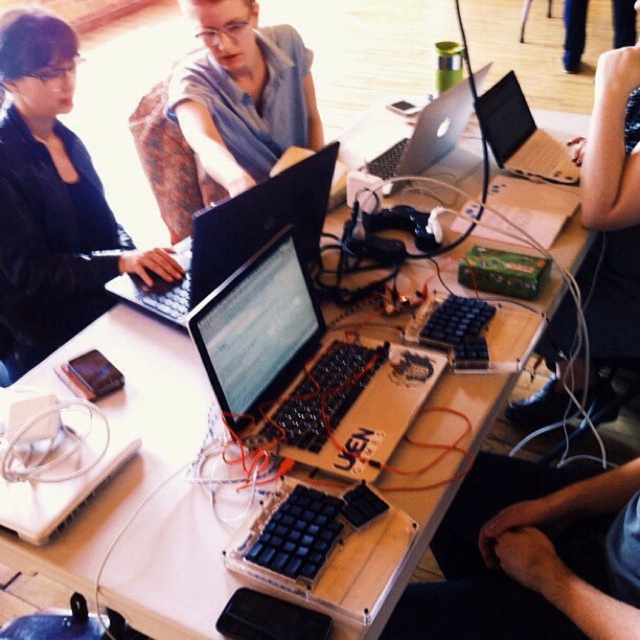
Does translucent plastic laptop at center have a larger size compared to black fabric sleeve at upper right?

No, translucent plastic laptop at center is not bigger than black fabric sleeve at upper right.

Image resolution: width=640 pixels, height=640 pixels. What are the coordinates of `translucent plastic laptop at center` in the screenshot? It's located at [x=305, y=371].

Does point (404, 346) come behind point (630, 324)?

No.

You are a GUI agent. You are given a task and a screenshot of the screen. Output one action in this format:
    pyautogui.click(x=<x>, y=<y>)
    Task: Click on the translucent plastic laptop at center
    
    Given the screenshot: What is the action you would take?
    pyautogui.click(x=305, y=371)

This screenshot has width=640, height=640. Describe the element at coordinates (531, 557) in the screenshot. I see `black matte keyboard at lower right` at that location.

Is point (529, 547) positioned after point (513, 113)?

That is False.

This screenshot has width=640, height=640. Find the location of `black matte keyboard at lower right`. black matte keyboard at lower right is located at coordinates (531, 557).

In the scene shown: Is silver metallic laptop at upper right to the left of satin silver laptop at center from the viewer's perspective?

No, silver metallic laptop at upper right is not to the left of satin silver laptop at center.

Is silver metallic laptop at upper right positioned in front of satin silver laptop at center?

No, silver metallic laptop at upper right is further to the viewer.

Is point (499, 147) less distant than point (445, 125)?

Yes, it is.

Locate an element on the screen. silver metallic laptop at upper right is located at coordinates (520, 134).